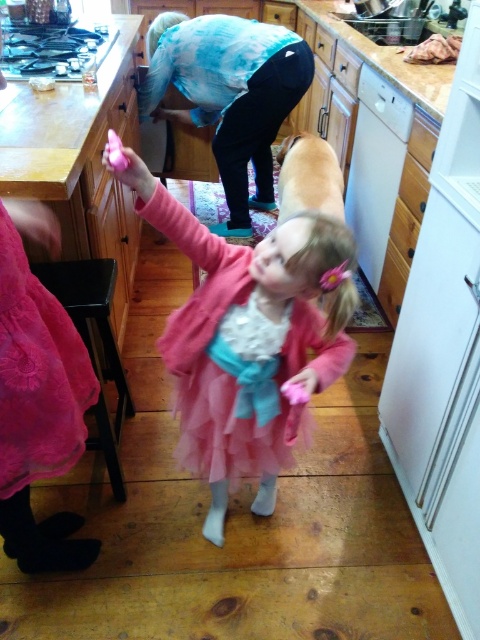
Based on the photo, in the kitchen scene described, there is a pink fluffy dress at center and a pink tulle ballet skirt at lower left. From the perspective of an observer facing the image, which object is positioned to the right of the other?

The pink fluffy dress at center is to the right of the pink tulle ballet skirt at lower left.

Looking at this image, you are organizing a costume party and need to decide which outfit takes up more space. Based on the image, which item between the pink fluffy dress at center and the pink tulle ballet skirt at lower left is wider?

The pink fluffy dress at center is wider than the pink tulle ballet skirt at lower left.